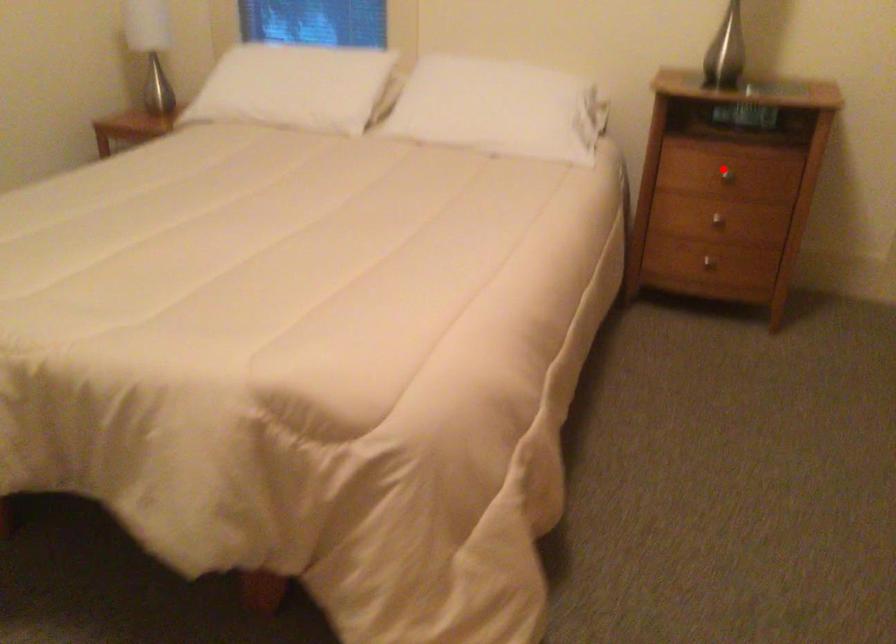
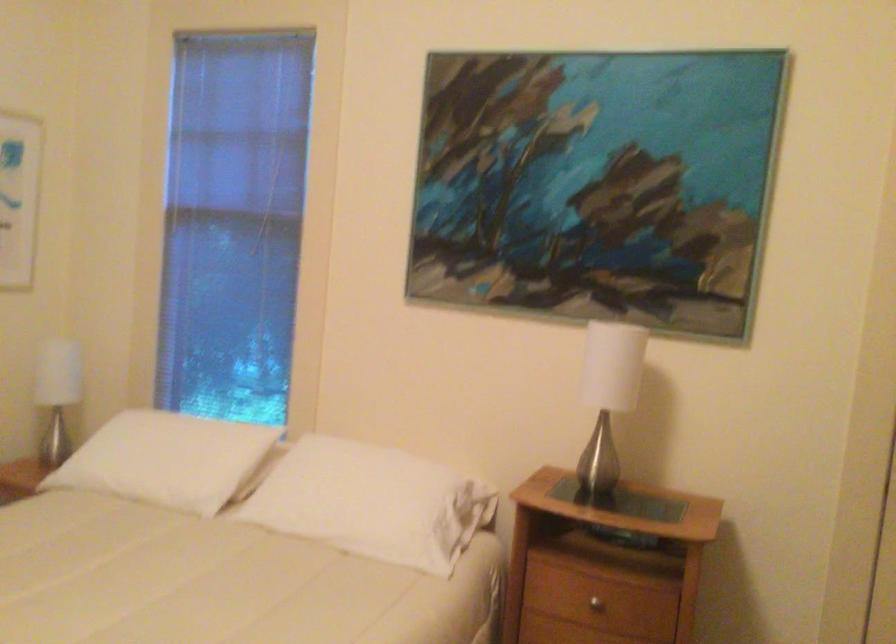
Where in the second image is the point corresponding to the highlighted location from the first image?

(597, 601)